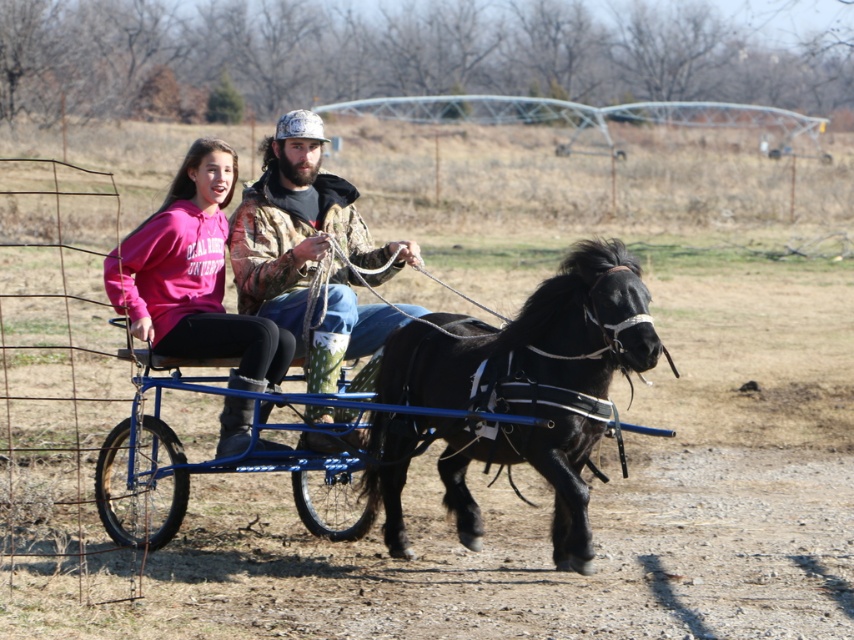
Question: Among these points, which one is farthest from the camera?

Choices:
 (A) (215, 193)
 (B) (578, 369)
 (C) (279, 284)

Answer: (A)

Question: Which point is farther to the camera?

Choices:
 (A) (153, 324)
 (B) (305, 214)
 (C) (113, 436)

Answer: (B)

Question: Which point is farther to the camera?

Choices:
 (A) pos(285,138)
 (B) pos(115,492)
 (C) pos(243,374)

Answer: (B)

Question: Is black glossy horse at center thinner than pink fleece sweatshirt at center?

Choices:
 (A) yes
 (B) no

Answer: (B)

Question: Does black glossy horse at center have a lesser width compared to pink fleece sweatshirt at center?

Choices:
 (A) yes
 (B) no

Answer: (B)

Question: Does pink fleece sweatshirt at center appear on the right side of blue metallic cart at center?

Choices:
 (A) no
 (B) yes

Answer: (A)